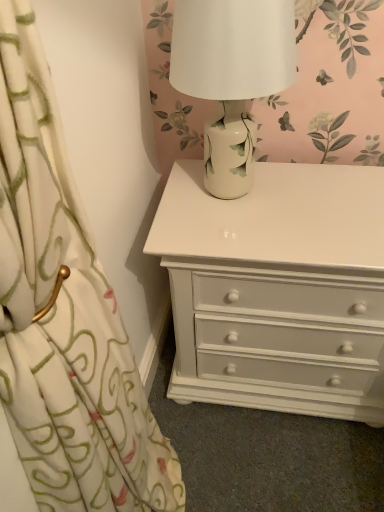
This screenshot has height=512, width=384. In order to click on vacant region to the right of white ceramic lamp at upper center in this screenshot , I will do `click(332, 195)`.